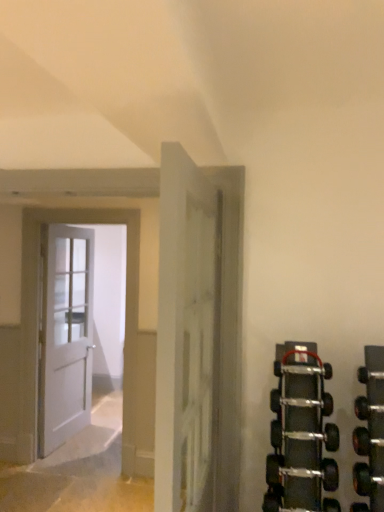
Question: Considering the relative positions of white wooden door at left, marked as the 2th door in a front-to-back arrangement, and white matte door at left, the 3th door when ordered from front to back, in the image provided, is white wooden door at left, marked as the 2th door in a front-to-back arrangement, to the left or to the right of white matte door at left, the 3th door when ordered from front to back,?

Choices:
 (A) left
 (B) right

Answer: (B)

Question: Considering the positions of white wooden door at left, marked as the 2th door in a front-to-back arrangement, and white matte door at left, the 3th door when ordered from front to back, in the image, is white wooden door at left, marked as the 2th door in a front-to-back arrangement, taller or shorter than white matte door at left, the 3th door when ordered from front to back,?

Choices:
 (A) tall
 (B) short

Answer: (A)

Question: Which is nearer to the white wooden door at left, marked as the 2th door in a front-to-back arrangement?

Choices:
 (A) white matte door at center, the 3th door in the left-to-right sequence
 (B) white matte door at left, the first door positioned from the left

Answer: (B)

Question: Considering the real-world distances, which object is closest to the white matte door at left, placed as the 1th door when sorted from back to front?

Choices:
 (A) white matte door at center, the 1th door viewed from the right
 (B) white wooden door at left, the second door from the back

Answer: (B)